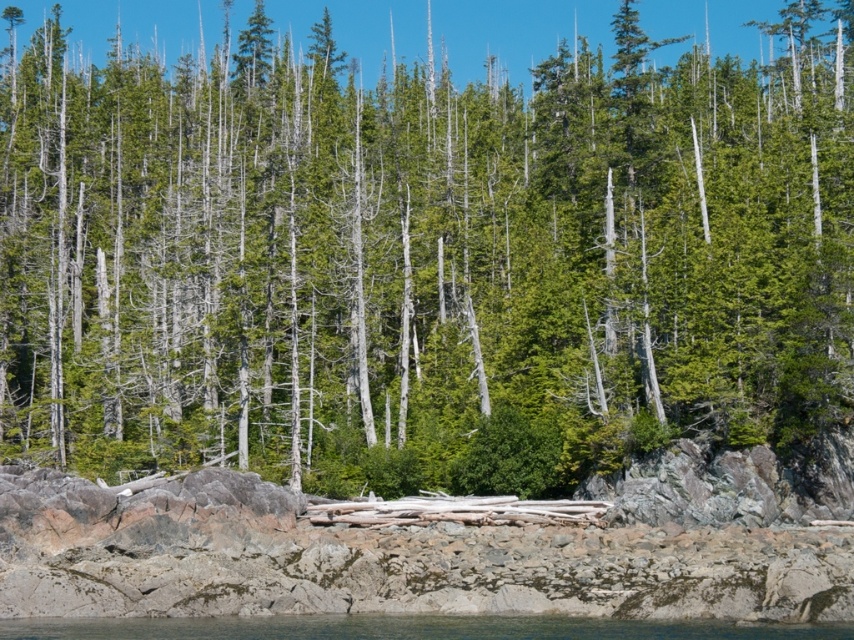
Is gray rock at lower center smaller than clear water at lower center?

No.

Does gray rock at lower center appear on the right side of clear water at lower center?

In fact, gray rock at lower center is to the left of clear water at lower center.

Where is `gray rock at lower center`? This screenshot has width=854, height=640. gray rock at lower center is located at coordinates (384, 561).